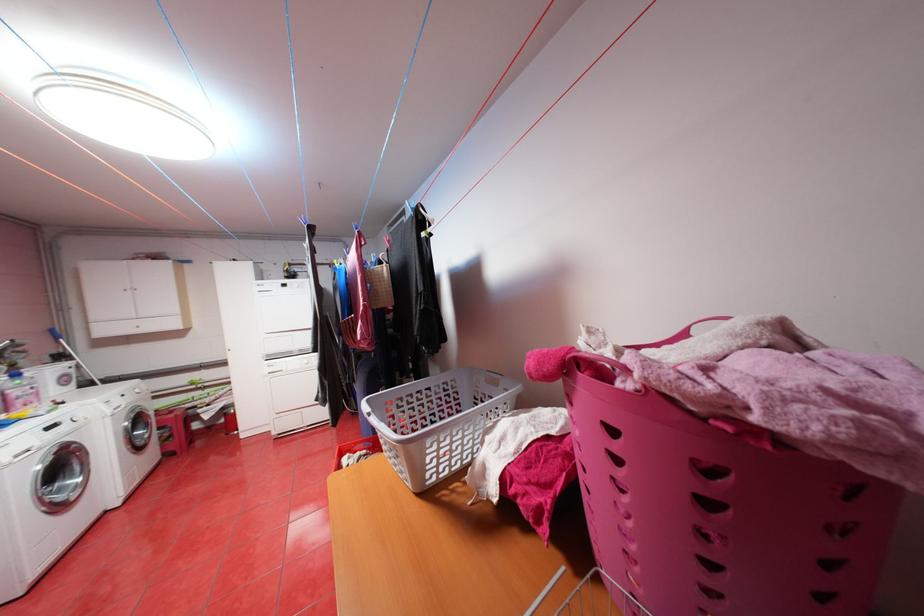
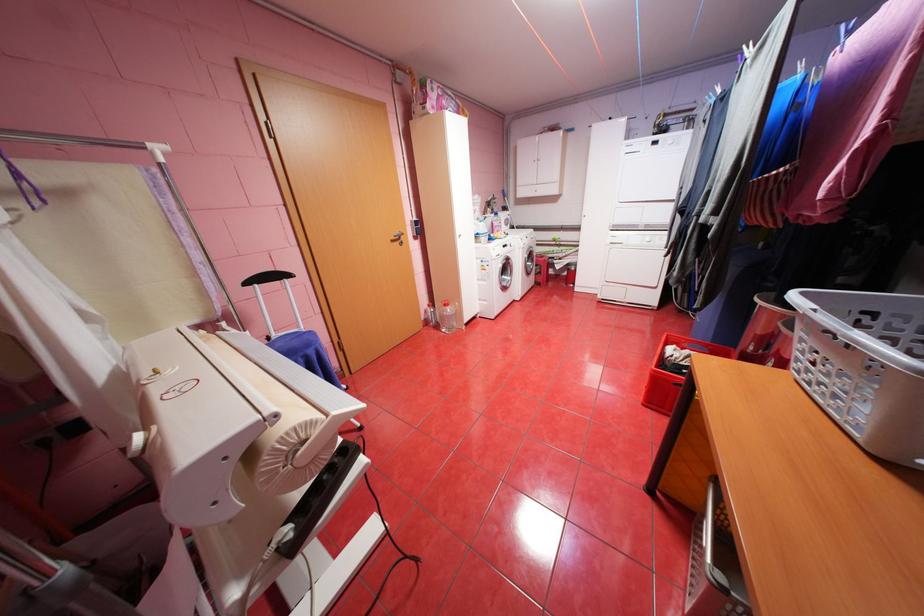
In the scene shown: How did the camera likely rotate?

The camera rotated toward left-down.